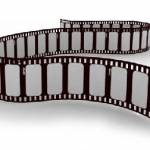
The height and width of the screenshot is (150, 150). I want to click on black slats, so click(x=129, y=86), click(x=86, y=83), click(x=108, y=82), click(x=67, y=80), click(x=45, y=83), click(x=23, y=81), click(x=14, y=49), click(x=25, y=49), click(x=35, y=42), click(x=69, y=42).